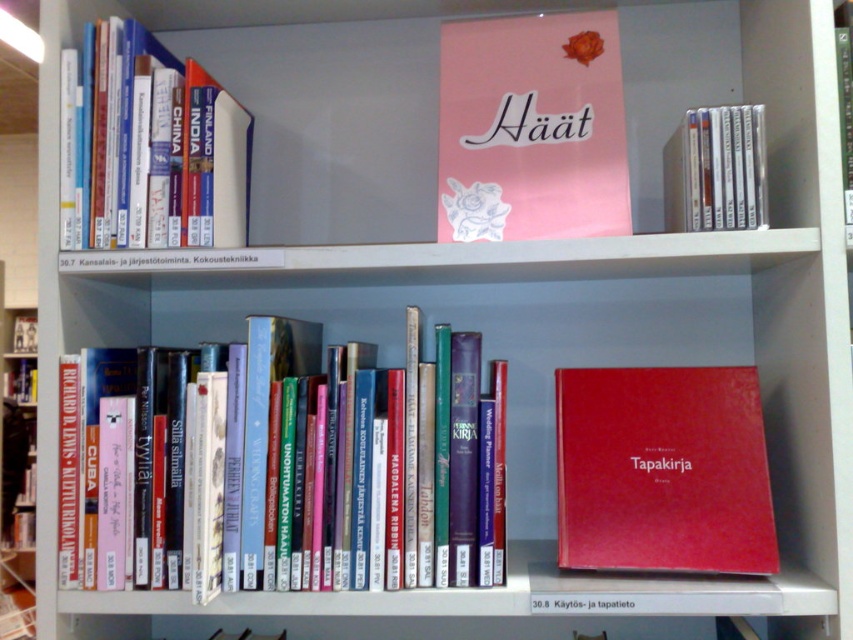
You are organizing a library and need to place a new book that is 15 cm in height. You have two options on the shelf where you want to place it. The hardcover books at left and the green matte book at upper center. Which one can the new book fit under without exceeding its height?

The new book can fit under the hardcover books at left because they are taller than the green matte book at upper center, so the space under them is sufficient for a 15 cm book.

You are standing in front of a bookshelf and want to reach the hardcover books at left. If your arm can extend 0.9 meters, can you comfortably reach them without moving your feet?

The hardcover books at left are 1.04 meters away from the camera, which is slightly beyond your arm extension of 0.9 meters. You might need to take a small step forward to comfortably reach them.

You are organizing a library and need to place a new book between the pink matte book at upper center and the green matte book at upper center. Which one should you place the new book above to maintain the current arrangement?

The pink matte book at upper center is already above the green matte book at upper center, so placing the new book above the pink matte book at upper center would maintain the current arrangement.